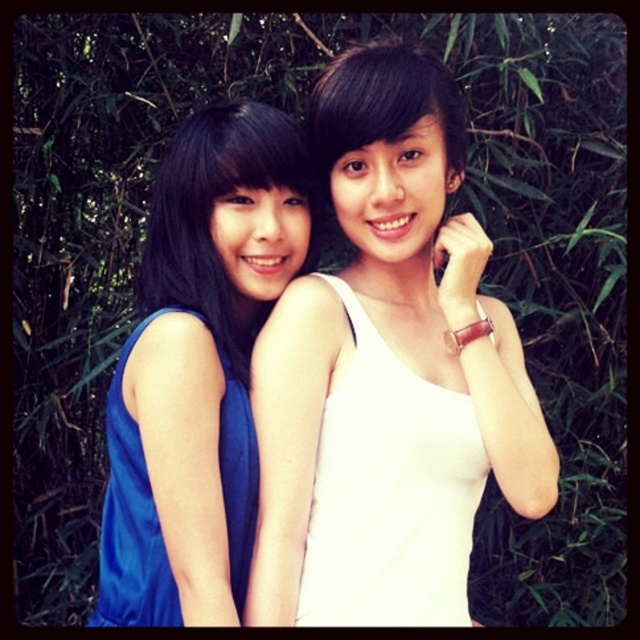
You are a fashion designer looking at two dresses displayed side by side on a mannequin. The dresses are the blue satin dress at left and the matte blue dress at left. Which dress is positioned higher on the mannequin?

The blue satin dress at left is positioned higher on the mannequin than the matte blue dress at left, as it is described as being above it.

You are a photographer standing 1.5 meters away from the white matte tank top at center. Can you comfortably take a clear photo without moving closer?

The white matte tank top at center and viewer are 1.34 meters apart from each other, so you are already closer than 1.5 meters. Therefore, you can comfortably take a clear photo without moving closer.

You are a photographer trying to capture a closeup of the blue satin dress at left without the white matte tank top at center blocking it. What adjustment should you make to your camera angle?

The blue satin dress at left is behind the white matte tank top at center, so you should move your camera angle forward to focus on the blue satin dress at left while moving past the white matte tank top at center.